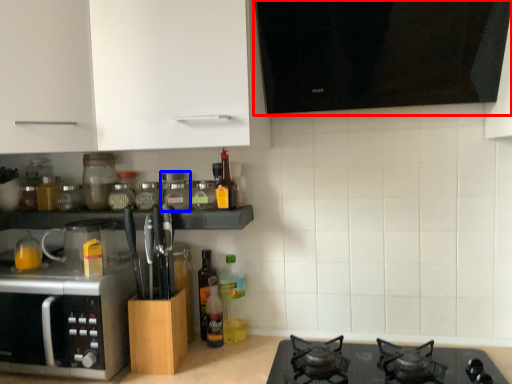
Question: Among these objects, which one is nearest to the camera, vent (highlighted by a red box) or glass jar (highlighted by a blue box)?

Choices:
 (A) vent
 (B) glass jar

Answer: (A)